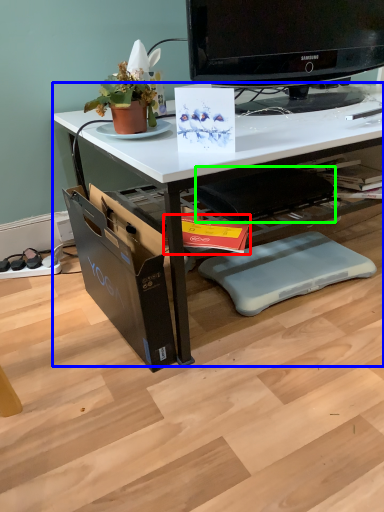
Question: Based on their relative distances, which object is farther from magazine (highlighted by a red box)? Choose from desk (highlighted by a blue box) and swivel chair (highlighted by a green box).

Choices:
 (A) desk
 (B) swivel chair

Answer: (A)